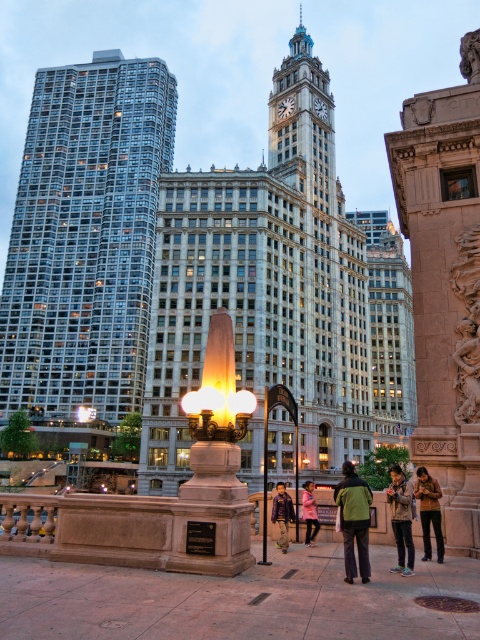
Is point (386, 401) positioned behind point (441, 490)?

Yes.

What do you see at coordinates (388, 328) in the screenshot? I see `gold textured building at center` at bounding box center [388, 328].

The image size is (480, 640). I want to click on gold textured building at center, so (388, 328).

Is point (460, 492) farther from camera compared to point (470, 77)?

No, (460, 492) is in front of (470, 77).

Measure the distance from carved stone monument at right to carved stone face at upper right.

carved stone monument at right is 33.14 meters away from carved stone face at upper right.

Does point (439, 253) come farther from viewer compared to point (479, 67)?

No, it is not.

I want to click on carved stone monument at right, so click(x=444, y=291).

Does glassy reflective building at left have a greater height compared to purple leather jacket at center?

Yes, glassy reflective building at left is taller than purple leather jacket at center.

The image size is (480, 640). What are the coordinates of `glassy reflective building at left` in the screenshot? It's located at (85, 237).